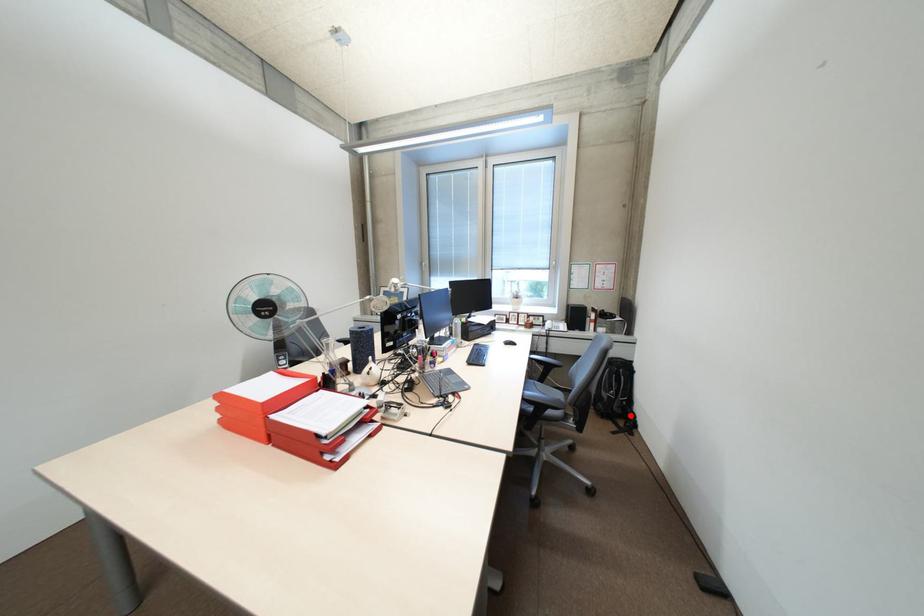
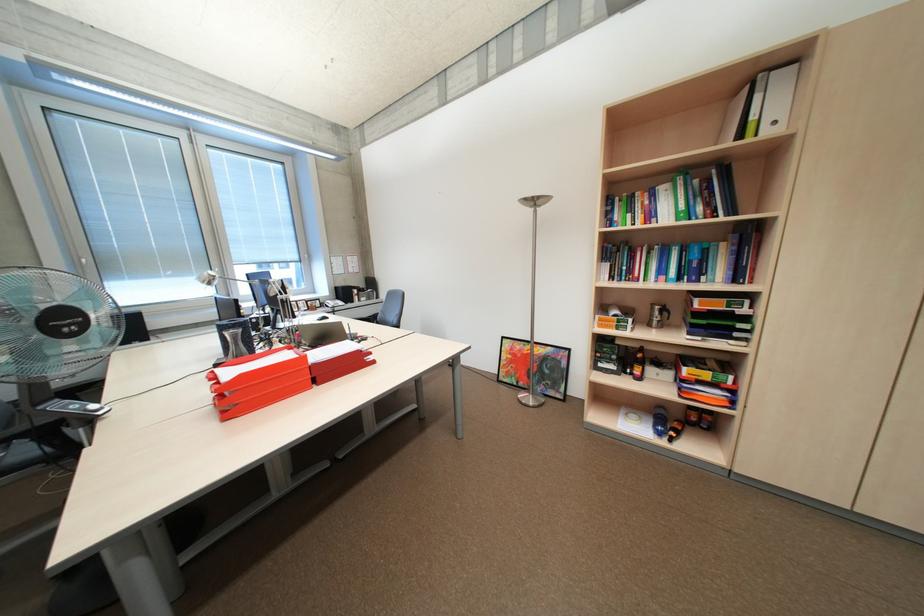
Question: I am providing you with two images of the same scene from different viewpoints. A red point is marked on the first image. Is the red point's position out of view in image 2?

Choices:
 (A) Yes
 (B) No

Answer: (A)